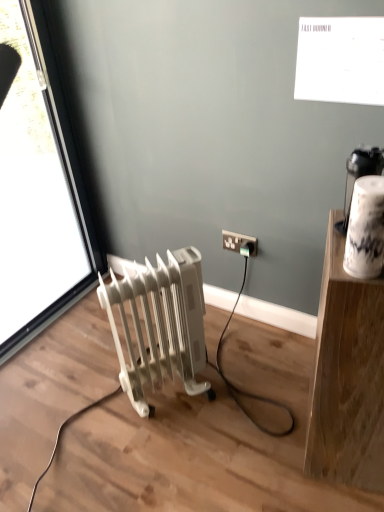
Locate an element on the screen. This screenshot has width=384, height=512. vacant space to the right of white plastic radiator at lower left is located at coordinates (241, 391).